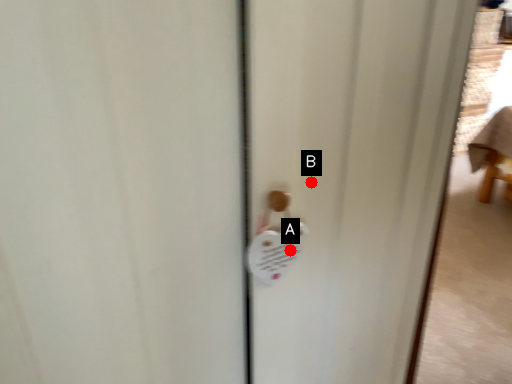
Question: Two points are circled on the image, labeled by A and B beside each circle. Among these points, which one is farthest from the camera?

Choices:
 (A) A is further
 (B) B is further

Answer: (A)